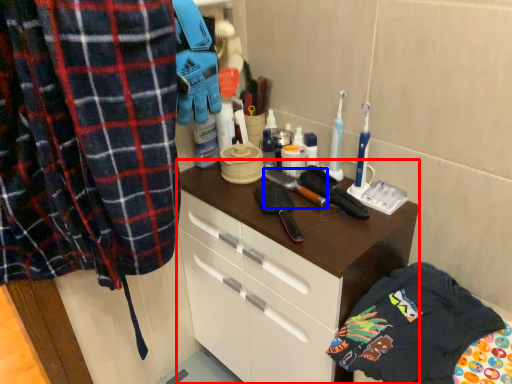
Question: Which point is further to the camera, cabinetry (highlighted by a red box) or brush (highlighted by a blue box)?

Choices:
 (A) cabinetry
 (B) brush

Answer: (B)